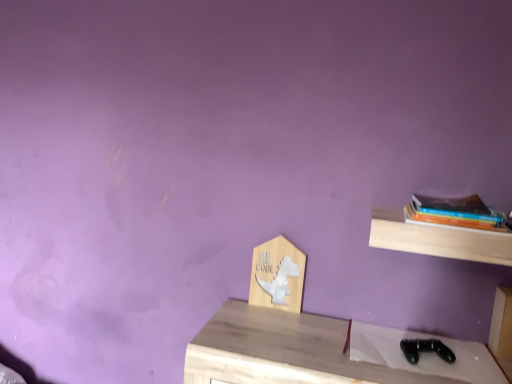
What is the approximate width of light wood shelf at upper right, which is the first shelf in front-to-back order?

9.27 inches.

In order to face light wood shelf at upper right, which appears as the second shelf when viewed from the back, should I rotate leftwards or rightwards?

Rotate right and turn 24.138 degrees.

This screenshot has height=384, width=512. Describe the element at coordinates (277, 275) in the screenshot. I see `wooden sign at center, which is the second shelf from front to back` at that location.

Where is `hardcover books at right`? This screenshot has height=384, width=512. hardcover books at right is located at coordinates (456, 212).

What do you see at coordinates (456, 212) in the screenshot? Image resolution: width=512 pixels, height=384 pixels. I see `hardcover books at right` at bounding box center [456, 212].

At what (x,y) coordinates should I click in order to perform the action: click on light wood shelf at upper right, which is the first shelf in front-to-back order. Please return your answer as a coordinate pair (x, y). The width and height of the screenshot is (512, 384). Looking at the image, I should click on (438, 239).

Is wooden sign at center, the 1th shelf viewed from the left, completely or partially outside of light wood shelf at upper right, which is the first shelf in front-to-back order?

wooden sign at center, the 1th shelf viewed from the left, is positioned outside light wood shelf at upper right, which is the first shelf in front-to-back order.

Can you confirm if wooden sign at center, the 1th shelf viewed from the left, is thinner than light wood shelf at upper right, which appears as the second shelf when viewed from the back?

Yes.

How many degrees apart are the facing directions of wooden sign at center, the first shelf when ordered from back to front, and light wood shelf at upper right, which is the first shelf in front-to-back order?

0.351 degrees separate the facing orientations of wooden sign at center, the first shelf when ordered from back to front, and light wood shelf at upper right, which is the first shelf in front-to-back order.

Which object is wider, hardcover books at right or light wood shelf at upper right, which is the first shelf in front-to-back order?

light wood shelf at upper right, which is the first shelf in front-to-back order, is wider.

Where is `the 1st shelf directly beneath the hardcover books at right (from a real-world perspective)`? The height and width of the screenshot is (384, 512). the 1st shelf directly beneath the hardcover books at right (from a real-world perspective) is located at coordinates (438, 239).

Does point (384, 221) come in front of point (288, 262)?

Yes, it is.

Is light wood shelf at upper right, the 2th shelf from the left, turned away from wooden sign at center, the 1th shelf viewed from the left?

No, light wood shelf at upper right, the 2th shelf from the left, is not facing the opposite direction of wooden sign at center, the 1th shelf viewed from the left.

Looking at this image, from a real-world perspective, is light wood shelf at upper right, the first shelf when ordered from right to left, positioned over wooden sign at center, the first shelf when ordered from back to front, based on gravity?

Yes, from a real-world perspective, light wood shelf at upper right, the first shelf when ordered from right to left, is over wooden sign at center, the first shelf when ordered from back to front

Is light wood shelf at upper right, the first shelf when ordered from right to left, closer to the viewer compared to wooden sign at center, the 1th shelf viewed from the left?

That is True.

Between hardcover books at right and wooden sign at center, the 1th shelf viewed from the left, which one has larger size?

hardcover books at right.

This screenshot has height=384, width=512. I want to click on book in front of the wooden sign at center, the 2th shelf in the right-to-left sequence, so pos(456,212).

From a real-world perspective, between hardcover books at right and wooden sign at center, the 2th shelf in the right-to-left sequence, who is vertically higher?

From a 3D spatial view, hardcover books at right is above.

Based on their sizes in the image, would you say wooden sign at center, which is the second shelf from front to back, is bigger or smaller than hardcover books at right?

In the image, wooden sign at center, which is the second shelf from front to back, appears to be smaller than hardcover books at right.

From a real-world perspective, is wooden sign at center, the first shelf when ordered from back to front, on top of hardcover books at right?

Incorrect, from a real-world perspective, wooden sign at center, the first shelf when ordered from back to front, is lower than hardcover books at right.

Consider the image. Is the position of wooden sign at center, which is the second shelf from front to back, less distant than that of hardcover books at right?

No, it is behind hardcover books at right.

Considering the positions of points (467, 256) and (499, 214), is point (467, 256) closer to camera compared to point (499, 214)?

That is True.

Is hardcover books at right inside light wood shelf at upper right, which is the first shelf in front-to-back order?

No, hardcover books at right is not a part of light wood shelf at upper right, which is the first shelf in front-to-back order.

Based on the photo, does light wood shelf at upper right, which is the first shelf in front-to-back order, have a lesser width compared to hardcover books at right?

No.

At what (x,y) coordinates should I click in order to perform the action: click on shelf lying in front of the wooden sign at center, the 1th shelf viewed from the left. Please return your answer as a coordinate pair (x, y). This screenshot has height=384, width=512. Looking at the image, I should click on (438, 239).

Locate an element on the screen. The height and width of the screenshot is (384, 512). book above the light wood shelf at upper right, which appears as the second shelf when viewed from the back (from a real-world perspective) is located at coordinates tap(456, 212).

From the image, which object appears to be nearer to light wood shelf at upper right, the first shelf when ordered from right to left, wooden sign at center, the first shelf when ordered from back to front, or hardcover books at right?

hardcover books at right is closer to light wood shelf at upper right, the first shelf when ordered from right to left.

From the picture: Based on their spatial positions, is wooden sign at center, which is the second shelf from front to back, or light wood shelf at upper right, which is the first shelf in front-to-back order, further from hardcover books at right?

Based on the image, wooden sign at center, which is the second shelf from front to back, appears to be further to hardcover books at right.

From the image, which object appears to be farther from light wood shelf at upper right, which appears as the second shelf when viewed from the back, hardcover books at right or wooden sign at center, the 1th shelf viewed from the left?

The object further to light wood shelf at upper right, which appears as the second shelf when viewed from the back, is wooden sign at center, the 1th shelf viewed from the left.

Based on their spatial positions, is light wood shelf at upper right, which appears as the second shelf when viewed from the back, or hardcover books at right further from wooden sign at center, the 2th shelf in the right-to-left sequence?

The object further to wooden sign at center, the 2th shelf in the right-to-left sequence, is hardcover books at right.

Considering their positions, is hardcover books at right positioned further to wooden sign at center, the 2th shelf in the right-to-left sequence, than light wood shelf at upper right, the 2th shelf from the left?

The object further to wooden sign at center, the 2th shelf in the right-to-left sequence, is hardcover books at right.

Which object lies nearer to the anchor point hardcover books at right, light wood shelf at upper right, the first shelf when ordered from right to left, or wooden sign at center, the first shelf when ordered from back to front?

Based on the image, light wood shelf at upper right, the first shelf when ordered from right to left, appears to be nearer to hardcover books at right.

The height and width of the screenshot is (384, 512). What are the coordinates of `shelf between wooden sign at center, the 2th shelf in the right-to-left sequence, and hardcover books at right` in the screenshot? It's located at (438, 239).